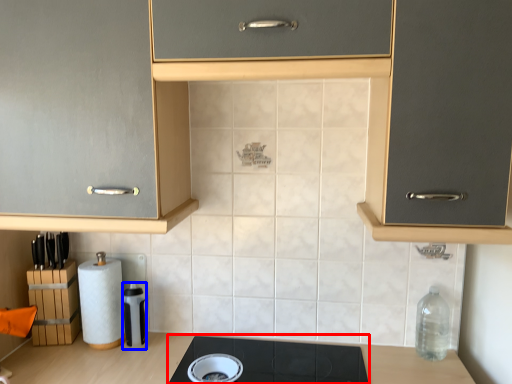
Question: Which object appears closest to the camera in this image, gas stove (highlighted by a red box) or appliance (highlighted by a blue box)?

Choices:
 (A) gas stove
 (B) appliance

Answer: (A)